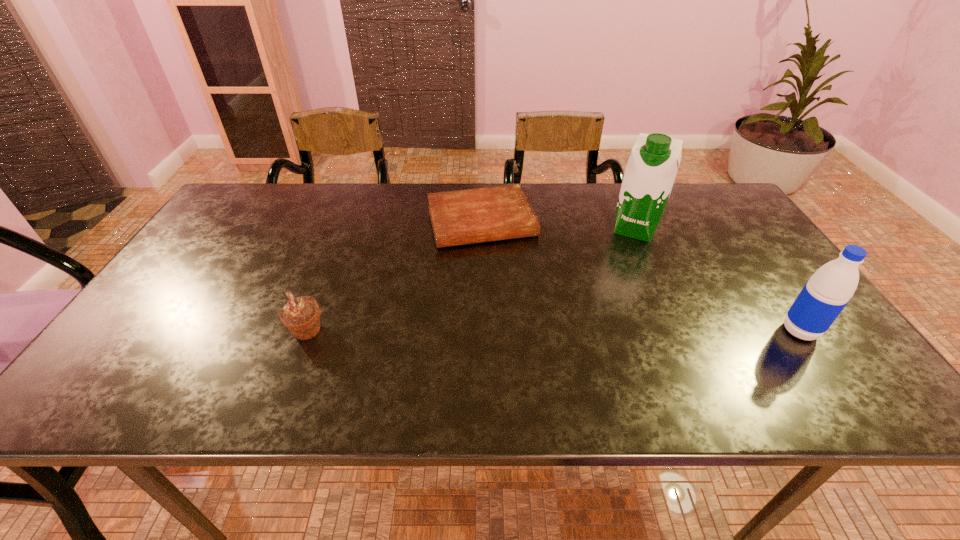
Point out which object is positioned as the nearest to the muffin. Please provide its 2D coordinates. Your answer should be formatted as a tuple, i.e. [(x, y)], where the tuple contains the x and y coordinates of a point satisfying the conditions above.

[(460, 217)]

Locate an element on the screen. Image resolution: width=960 pixels, height=540 pixels. free space that satisfies the following two spatial constraints: 1. on the front side of the muffin; 2. on the right side of the third shortest object is located at coordinates (306, 331).